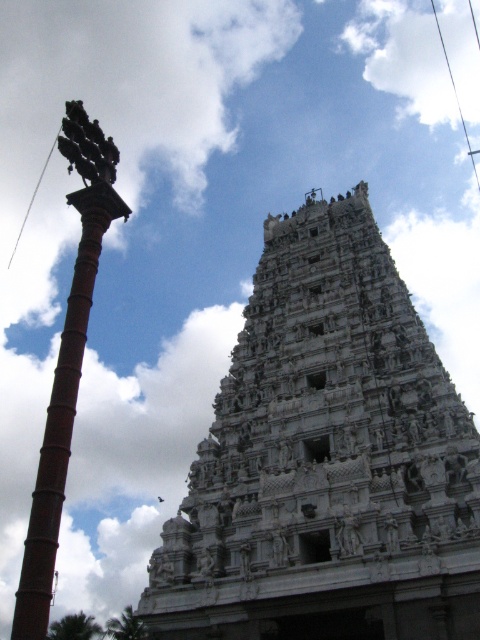
You are a photographer planning to capture the white stone temple at center and the brown brick pole at left in a single shot. Based on their positions, which object will appear larger in the photo?

The white stone temple at center appears larger in the photo because it is positioned closer to the camera than the brown brick pole at left.